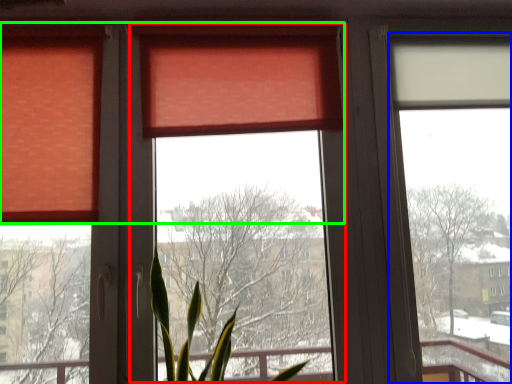
Question: Which is nearer to the window screen (highlighted by a red box)? window screen (highlighted by a blue box) or curtain (highlighted by a green box).

Choices:
 (A) window screen
 (B) curtain

Answer: (B)